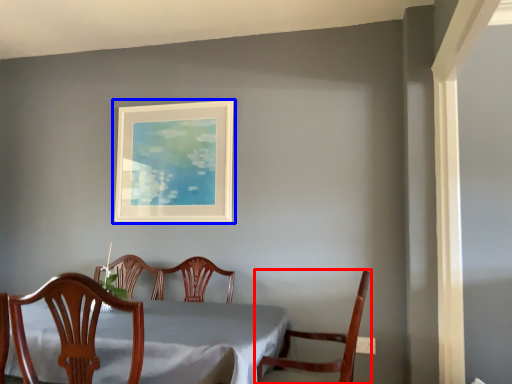
Question: Among these objects, which one is farthest to the camera, chair (highlighted by a red box) or picture frame (highlighted by a blue box)?

Choices:
 (A) chair
 (B) picture frame

Answer: (B)